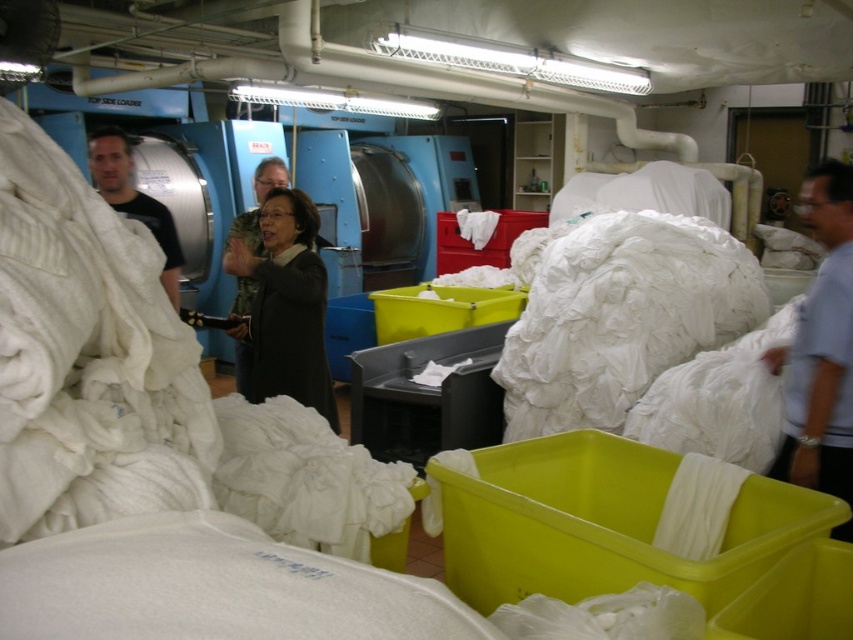
Question: Among these points, which one is nearest to the camera?

Choices:
 (A) pos(254,237)
 (B) pos(810,301)
 (C) pos(167,273)

Answer: (B)

Question: Which of the following is the farthest from the observer?

Choices:
 (A) dark gray sweater at center
 (B) light blue shirt at right
 (C) black matte shirt at left
 (D) black fabric at center

Answer: (A)

Question: Considering the relative positions of light blue shirt at right and black matte shirt at left in the image provided, where is light blue shirt at right located with respect to black matte shirt at left?

Choices:
 (A) below
 (B) above

Answer: (A)

Question: Does black matte shirt at left appear over dark gray sweater at center?

Choices:
 (A) yes
 (B) no

Answer: (A)

Question: Which point appears farthest from the camera in this image?

Choices:
 (A) (122, 154)
 (B) (839, 480)

Answer: (A)

Question: Does light blue shirt at right appear under black fabric at center?

Choices:
 (A) yes
 (B) no

Answer: (A)